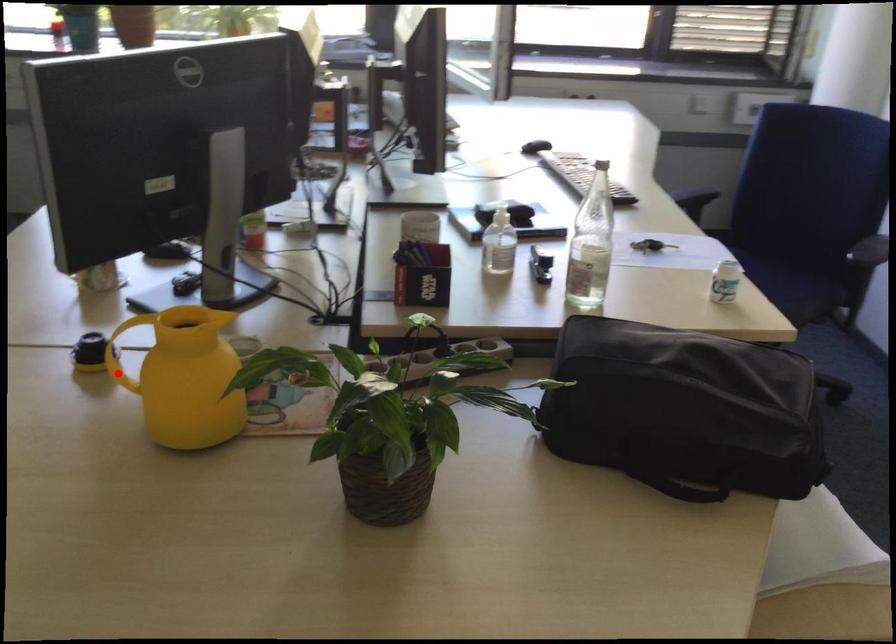
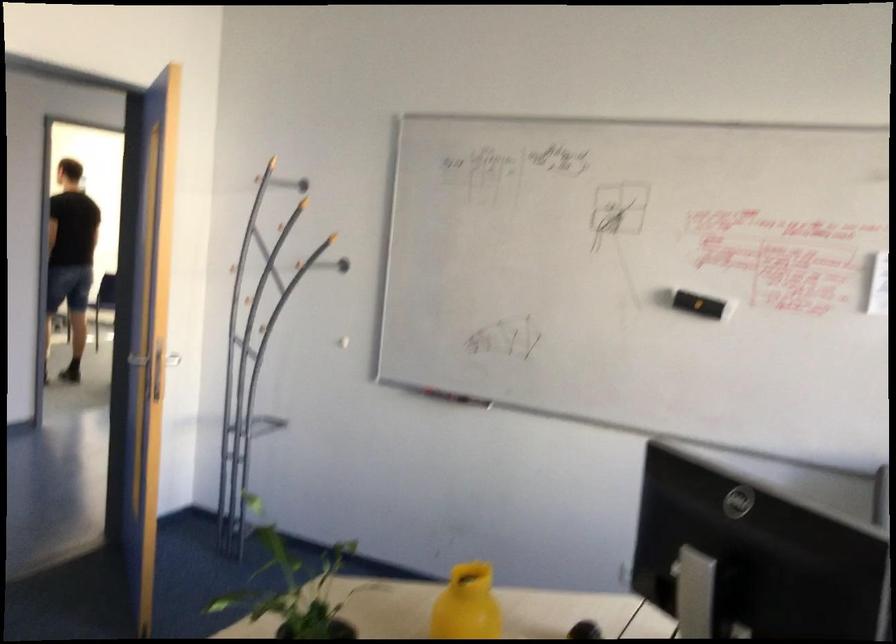
In the second image, find the point that corresponds to the highlighted location in the first image.

(467, 605)